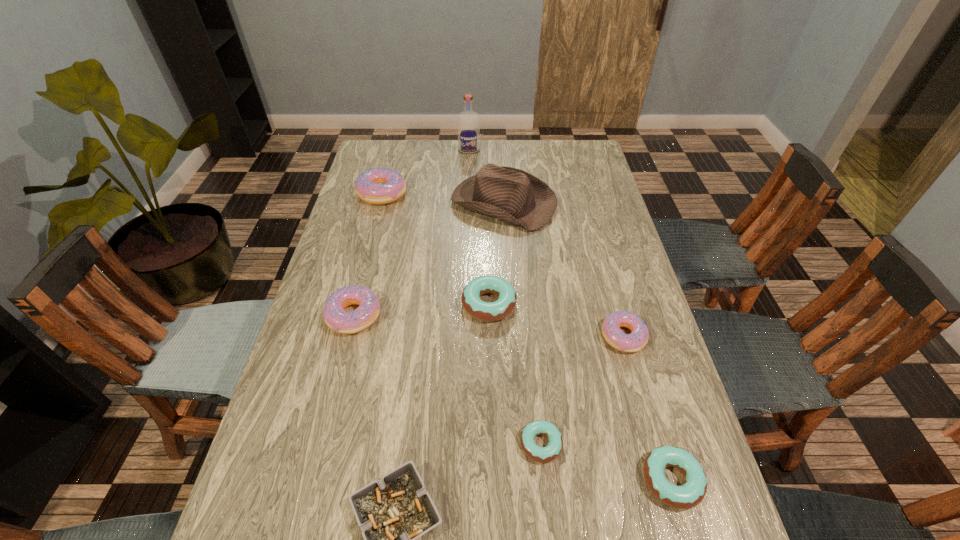
At what (x,y) coordinates should I click in order to perform the action: click on the rightmost blue doughnut. Please return your answer as a coordinate pair (x, y). This screenshot has height=540, width=960. Looking at the image, I should click on (690, 494).

The image size is (960, 540). Identify the location of the shortest doughnut. (539, 454).

You are a GUI agent. You are given a task and a screenshot of the screen. Output one action in this format:
    pyautogui.click(x=<x>, y=<y>)
    Task: Click on the shortest object
    The image size is (960, 540).
    Given the screenshot: What is the action you would take?
    pyautogui.click(x=539, y=454)

Locate an element on the screen. The height and width of the screenshot is (540, 960). vacant space located 0.220m on the label of the farthest object is located at coordinates (468, 187).

Locate an element on the screen. Image resolution: width=960 pixels, height=540 pixels. vacant space situated on the left of the second tallest object is located at coordinates (431, 203).

Find the location of a particular element. free spot located 0.200m on the back of the biggest pink doughnut is located at coordinates (394, 151).

Locate an element on the screen. The image size is (960, 540). free point located 0.170m on the right of the fifth shortest doughnut is located at coordinates pos(444,315).

Identify the location of free space located on the right of the biggest blue doughnut. (630, 304).

Where is `vacant space located on the left of the rightmost pink doughnut`? This screenshot has height=540, width=960. vacant space located on the left of the rightmost pink doughnut is located at coordinates (445, 336).

What are the coordinates of `vacant point located on the left of the fifth tallest doughnut` in the screenshot? It's located at (522, 480).